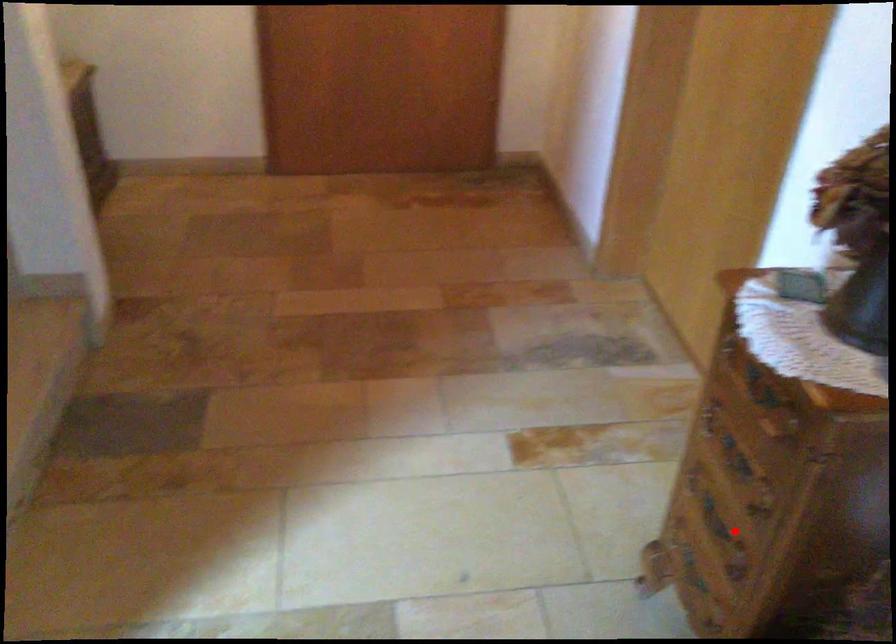
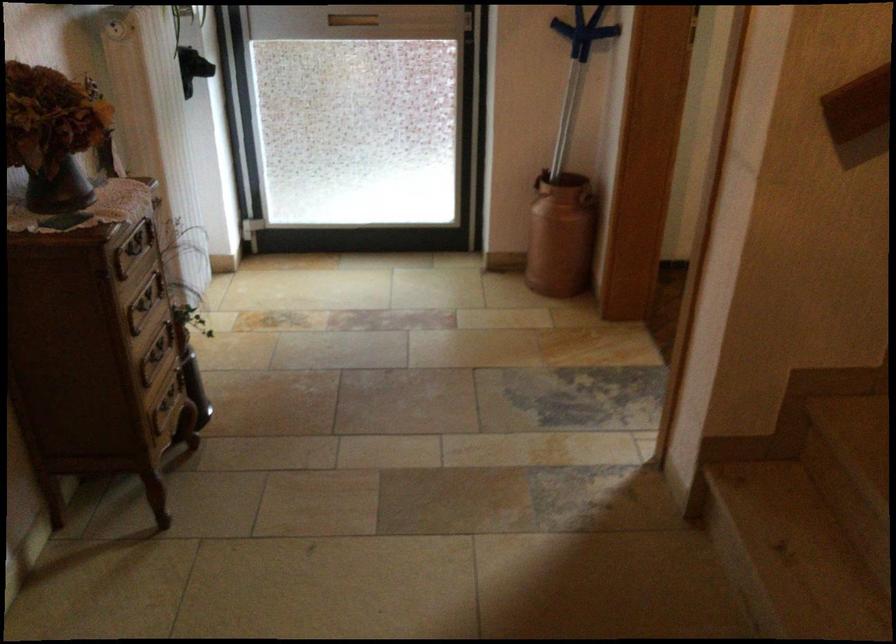
Where in the second image is the point corresponding to the highlighted location from the first image?

(156, 355)